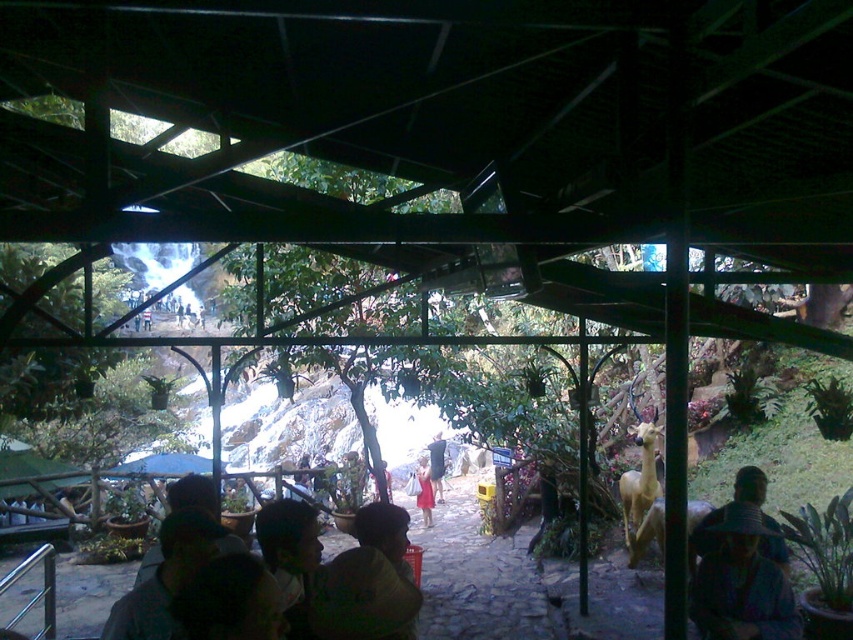
Question: Which object appears farthest from the camera in this image?

Choices:
 (A) matte red dress at center
 (B) dark gray fabric hat at lower right

Answer: (A)

Question: Is dark gray fabric hat at lower right to the right of red fabric dress at center from the viewer's perspective?

Choices:
 (A) no
 (B) yes

Answer: (B)

Question: Which of the following is the closest to the observer?

Choices:
 (A) red fabric dress at center
 (B) dark gray fabric hat at lower right

Answer: (B)

Question: Which point is closer to the camera?

Choices:
 (A) coord(248,280)
 (B) coord(704,524)
 (C) coord(439,474)
 (D) coord(177,458)

Answer: (B)

Question: Is green leafy tree at upper center closer to camera compared to red fabric dress at center?

Choices:
 (A) no
 (B) yes

Answer: (B)

Question: Is red fabric dress at center to the left of matte red dress at center from the viewer's perspective?

Choices:
 (A) no
 (B) yes

Answer: (B)